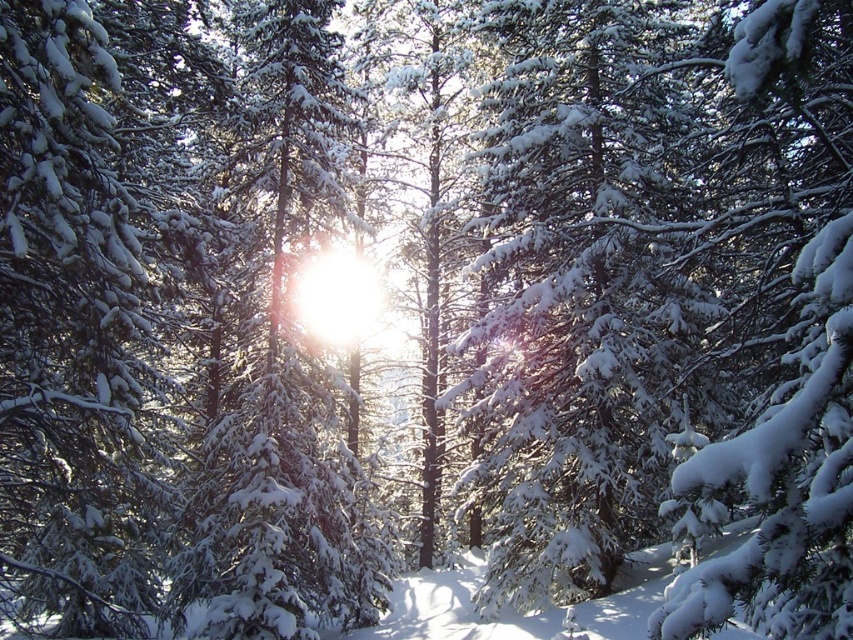
You are a hiker navigating a snow trail in the forest. You come across two points marked on your map as point 1 at coordinates [111,113] and point 2 at coordinates [318,83]. Which point is closer to your current position if you are standing at the start of the trail?

Point 1 at coordinates [111,113] is closer to your current position because it is positioned in front of point 2 at coordinates [318,83] along the trail.